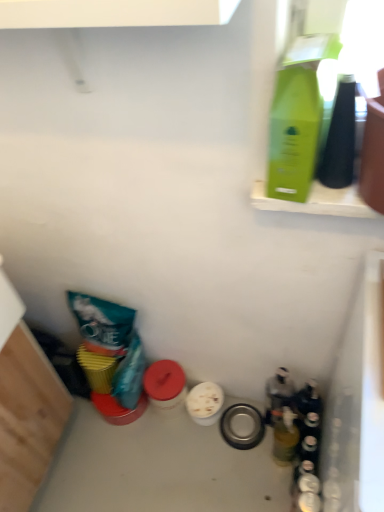
Question: Does translucent glass bottle at lower right, which appears as the second bottle when ordered from the bottom, have a smaller size compared to green matte bottle at upper right, marked as the 1th bottle in a top-to-bottom arrangement?

Choices:
 (A) no
 (B) yes

Answer: (B)

Question: Is translucent glass bottle at lower right, arranged as the 3th bottle when viewed from the front, not inside green matte bottle at upper right, which is counted as the first bottle, starting from the front?

Choices:
 (A) no
 (B) yes

Answer: (B)

Question: Is translucent glass bottle at lower right, arranged as the 3th bottle when viewed from the front, to the right of green matte bottle at upper right, placed as the third bottle when sorted from bottom to top, from the viewer's perspective?

Choices:
 (A) no
 (B) yes

Answer: (B)

Question: Can you confirm if translucent glass bottle at lower right, which appears as the second bottle when ordered from the bottom, is bigger than green matte bottle at upper right, which is counted as the first bottle, starting from the front?

Choices:
 (A) no
 (B) yes

Answer: (A)

Question: Is translucent glass bottle at lower right, which appears as the second bottle when ordered from the bottom, far from green matte bottle at upper right, which is counted as the first bottle, starting from the front?

Choices:
 (A) yes
 (B) no

Answer: (B)

Question: From a real-world perspective, is translucent glass bottle at lower right, which appears as the second bottle when ordered from the bottom, physically below green matte bottle at upper right, marked as the 1th bottle in a top-to-bottom arrangement?

Choices:
 (A) no
 (B) yes

Answer: (B)

Question: Does green matte bottle at upper right, marked as the 1th bottle in a top-to-bottom arrangement, have a smaller size compared to translucent glass bottle at lower right, which ranks as the 2th bottle in front-to-back order?

Choices:
 (A) yes
 (B) no

Answer: (B)

Question: Considering the relative sizes of green matte bottle at upper right, placed as the third bottle when sorted from bottom to top, and translucent glass bottle at lower right, which ranks as the 2th bottle in front-to-back order, in the image provided, is green matte bottle at upper right, placed as the third bottle when sorted from bottom to top, bigger than translucent glass bottle at lower right, which ranks as the 2th bottle in front-to-back order,?

Choices:
 (A) no
 (B) yes

Answer: (B)

Question: Is green matte bottle at upper right, the 3th bottle in the back-to-front sequence, to the right of translucent glass bottle at lower right, which is the third bottle in top-to-bottom order, from the viewer's perspective?

Choices:
 (A) yes
 (B) no

Answer: (B)

Question: Is green matte bottle at upper right, marked as the 1th bottle in a top-to-bottom arrangement, closer to camera compared to translucent glass bottle at lower right, which ranks as the 1th bottle in bottom-to-top order?

Choices:
 (A) no
 (B) yes

Answer: (B)

Question: Considering the relative sizes of green matte bottle at upper right, which is counted as the first bottle, starting from the front, and translucent glass bottle at lower right, which is the third bottle in top-to-bottom order, in the image provided, is green matte bottle at upper right, which is counted as the first bottle, starting from the front, shorter than translucent glass bottle at lower right, which is the third bottle in top-to-bottom order,?

Choices:
 (A) yes
 (B) no

Answer: (A)

Question: From the image's perspective, is green matte bottle at upper right, placed as the third bottle when sorted from bottom to top, on top of translucent glass bottle at lower right, the 2th bottle from the back?

Choices:
 (A) yes
 (B) no

Answer: (A)

Question: Is translucent glass bottle at lower right, which is the third bottle in top-to-bottom order, completely or partially outside of green matte bottle at upper right, the 3th bottle in the back-to-front sequence?

Choices:
 (A) yes
 (B) no

Answer: (A)